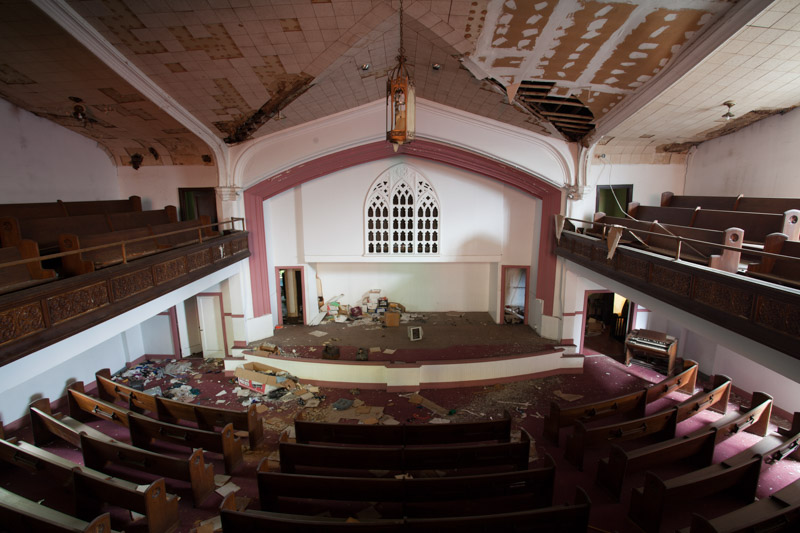
You are a GUI agent. You are given a task and a screenshot of the screen. Output one action in this format:
    pyautogui.click(x=<x>, y=<y>)
    Task: Click on the door
    The image size is (800, 533).
    Given the screenshot: What is the action you would take?
    pyautogui.click(x=517, y=306)